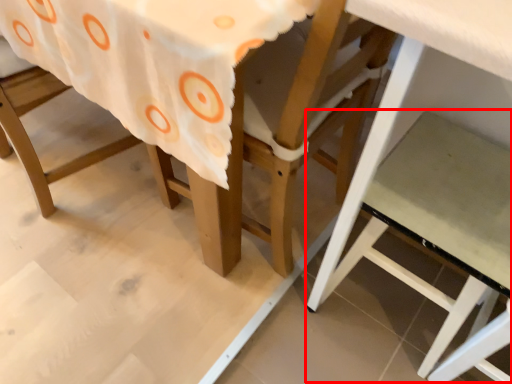
Question: From the image, what is the correct spatial relationship of step stool (annotated by the red box) in relation to chair?

Choices:
 (A) left
 (B) right

Answer: (B)